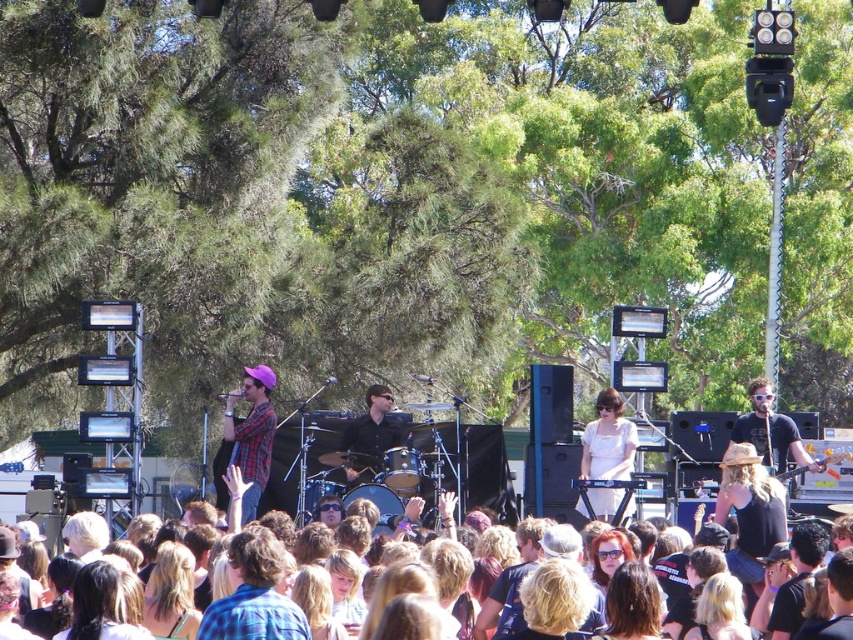
Question: Is white matte dress at center above plaid fabric shirt at center?

Choices:
 (A) no
 (B) yes

Answer: (A)

Question: Is black matte shirt at center below brown hair at center?

Choices:
 (A) yes
 (B) no

Answer: (B)

Question: Which point appears farthest from the camera in this image?

Choices:
 (A) (254, 465)
 (B) (352, 449)

Answer: (B)

Question: Based on their relative distances, which object is nearer to the black matte shirt at center?

Choices:
 (A) white matte dress at center
 (B) brown hair at center
 (C) plaid fabric shirt at center

Answer: (C)

Question: Does plaid fabric shirt at center appear over black matte shirt at center?

Choices:
 (A) no
 (B) yes

Answer: (A)

Question: Which point is farther from the camera taking this photo?

Choices:
 (A) (367, 433)
 (B) (12, 582)
 (C) (248, 438)

Answer: (A)